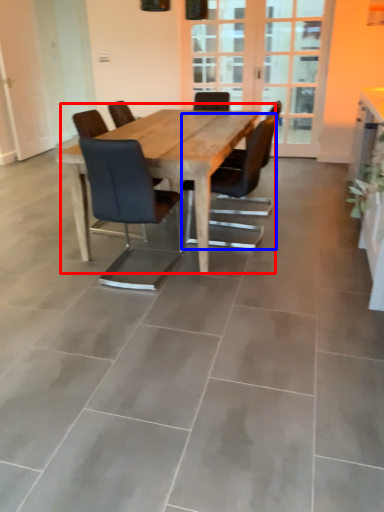
Question: Which of the following is the farthest to the observer, kitchen & dining room table (highlighted by a red box) or chair (highlighted by a blue box)?

Choices:
 (A) kitchen & dining room table
 (B) chair

Answer: (B)